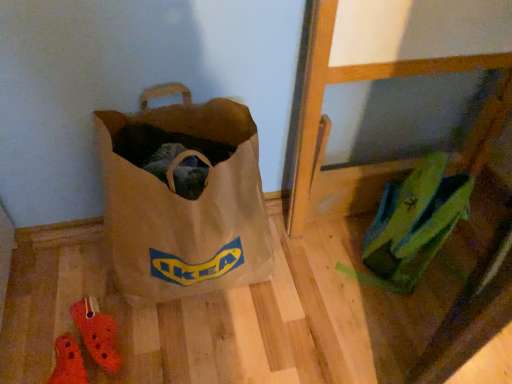
Locate an element on the screen. The image size is (512, 384). free space to the right of green fabric backpack at upper right is located at coordinates (453, 260).